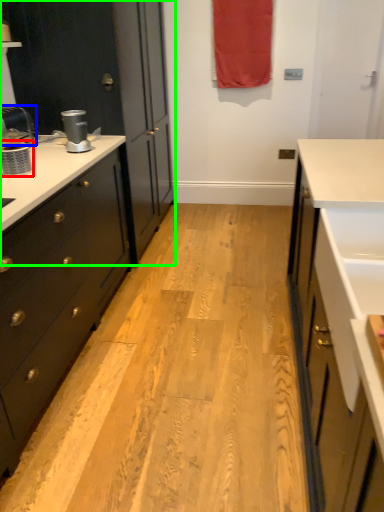
Question: Which object is positioned closest to appliance (highlighted by a red box)? Select from faucet (highlighted by a blue box) and cabinetry (highlighted by a green box).

Choices:
 (A) faucet
 (B) cabinetry

Answer: (A)